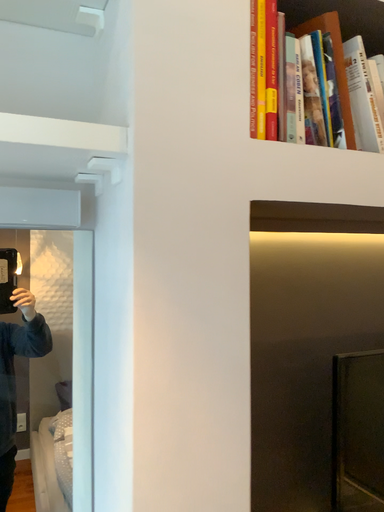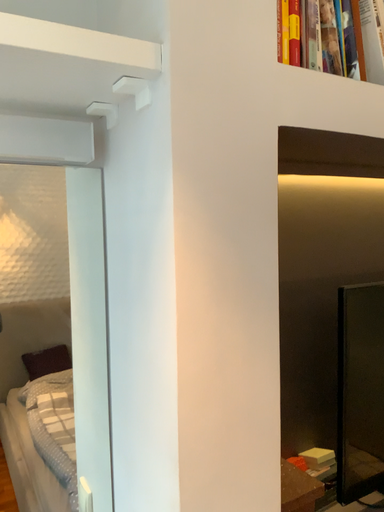
Question: Which way did the camera rotate in the video?

Choices:
 (A) rotated right
 (B) rotated left

Answer: (A)